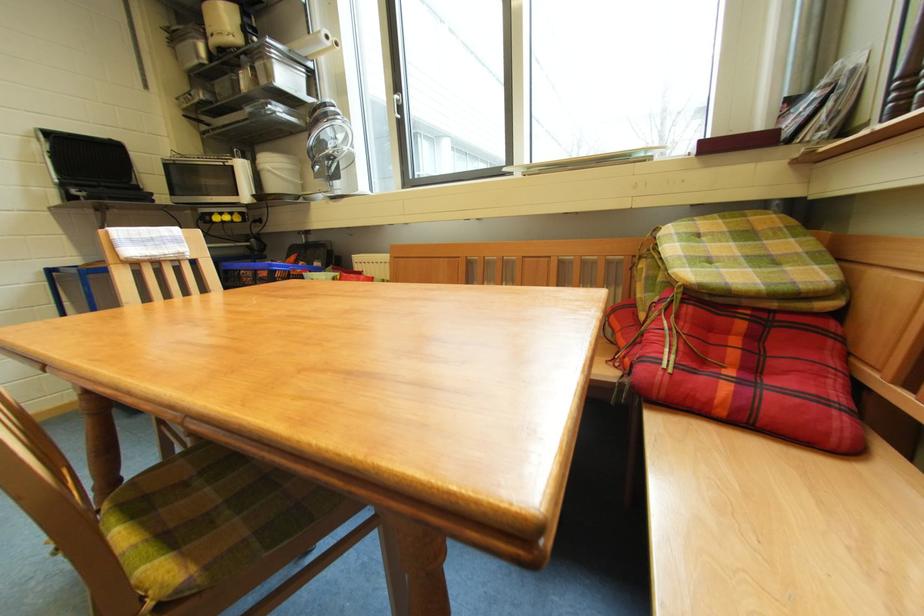
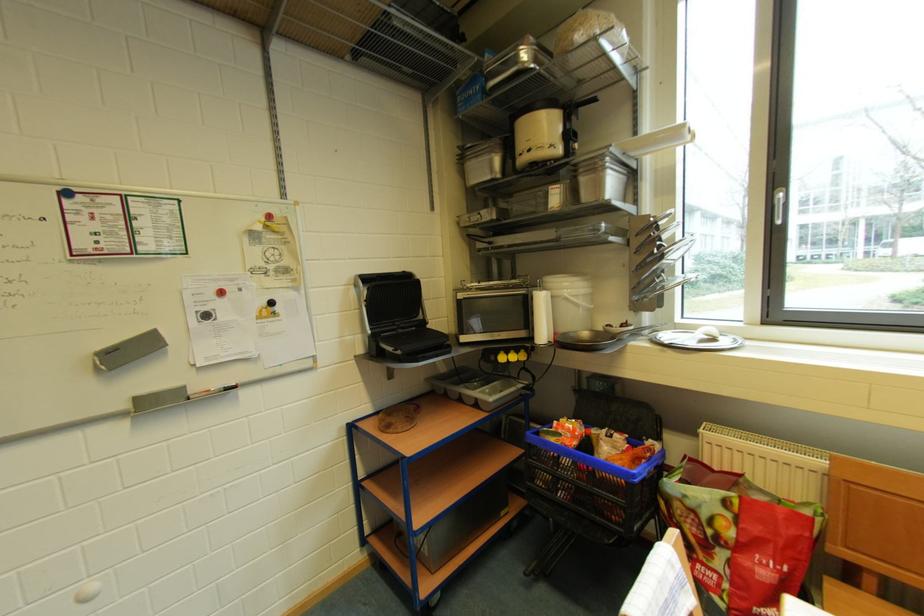
Question: In a continuous first-person perspective shot, in which direction is the camera moving?

Choices:
 (A) Left
 (B) Right
 (C) Forward
 (D) Backward

Answer: (A)